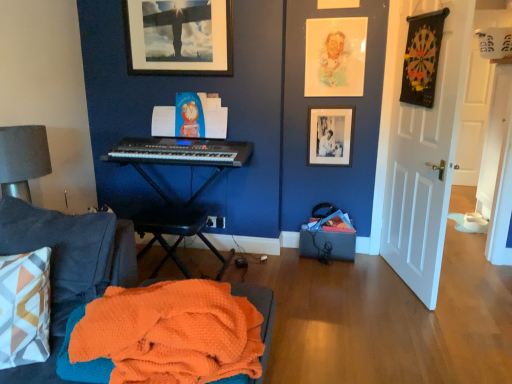
At what (x,y) coordinates should I click in order to perform the action: click on vacant area situated below white matte door at right (from a real-world perspective). Please return your answer as a coordinate pair (x, y). The image size is (512, 384). Looking at the image, I should click on (394, 278).